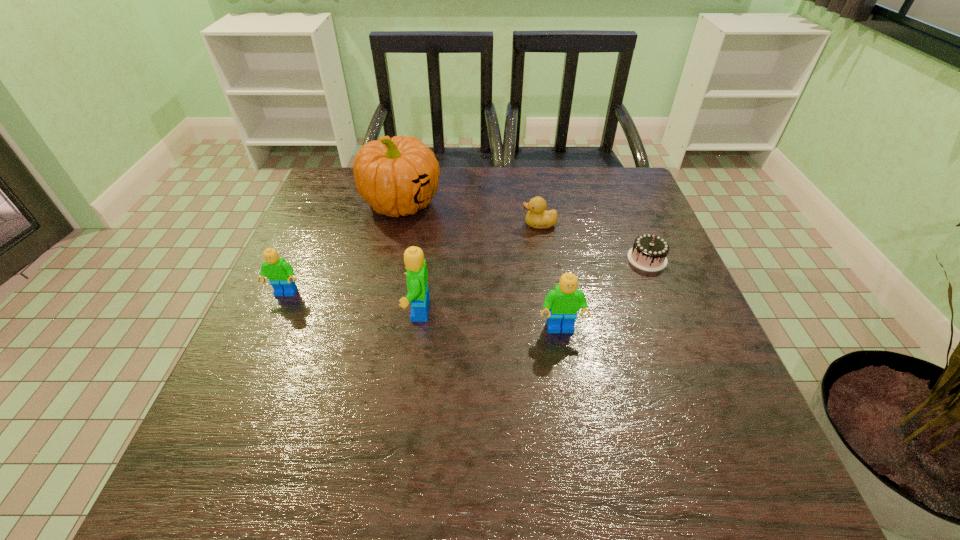
The width and height of the screenshot is (960, 540). I want to click on vacant space at the near right corner of the desktop, so click(706, 407).

Locate an element on the screen. free space that is in between the fourth tallest object and the second Lego from left to right is located at coordinates (351, 302).

Locate an element on the screen. The height and width of the screenshot is (540, 960). free space between the rightmost Lego and the pumpkin is located at coordinates (481, 266).

Find the location of a particular element. vacant area that lies between the third tallest object and the rightmost object is located at coordinates (604, 294).

Where is `vacant point located between the rightmost object and the pumpkin`? This screenshot has width=960, height=540. vacant point located between the rightmost object and the pumpkin is located at coordinates (524, 231).

The height and width of the screenshot is (540, 960). I want to click on unoccupied position between the duckling and the chocolate cake, so click(593, 241).

The width and height of the screenshot is (960, 540). What are the coordinates of `empty space that is in between the duckling and the rightmost Lego` in the screenshot? It's located at (550, 277).

This screenshot has width=960, height=540. Find the location of `empty location between the second tallest Lego and the rightmost object`. empty location between the second tallest Lego and the rightmost object is located at coordinates (604, 294).

Image resolution: width=960 pixels, height=540 pixels. I want to click on free spot between the second Lego from right to left and the shortest Lego, so click(x=351, y=302).

In order to click on free space that is in between the shortest Lego and the third farthest object in this screenshot , I will do `click(467, 276)`.